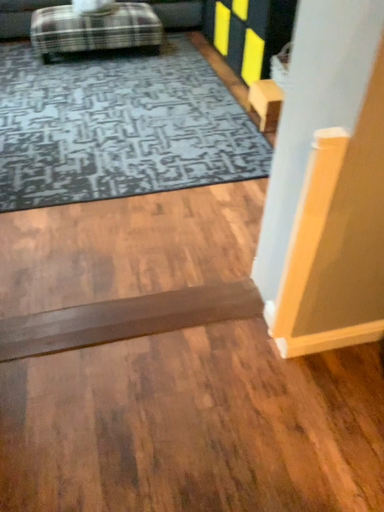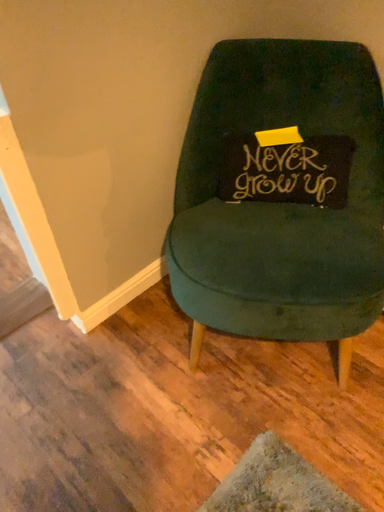
Question: How did the camera likely rotate when shooting the video?

Choices:
 (A) rotated left
 (B) rotated right

Answer: (B)